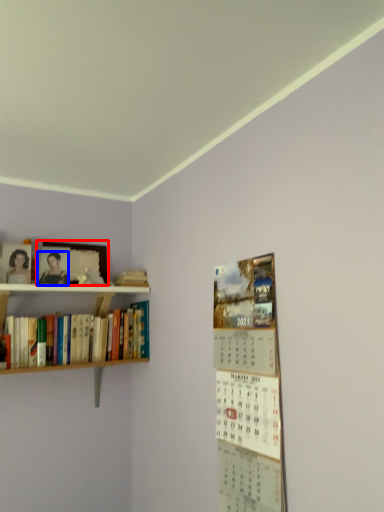
Question: Which object appears farthest to the camera in this image, picture frame (highlighted by a red box) or person (highlighted by a blue box)?

Choices:
 (A) picture frame
 (B) person

Answer: (A)